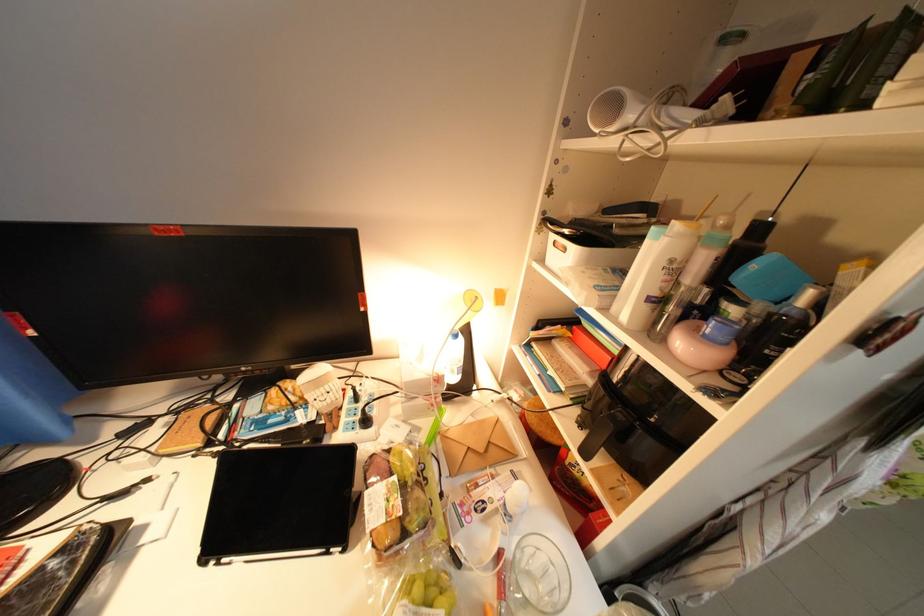
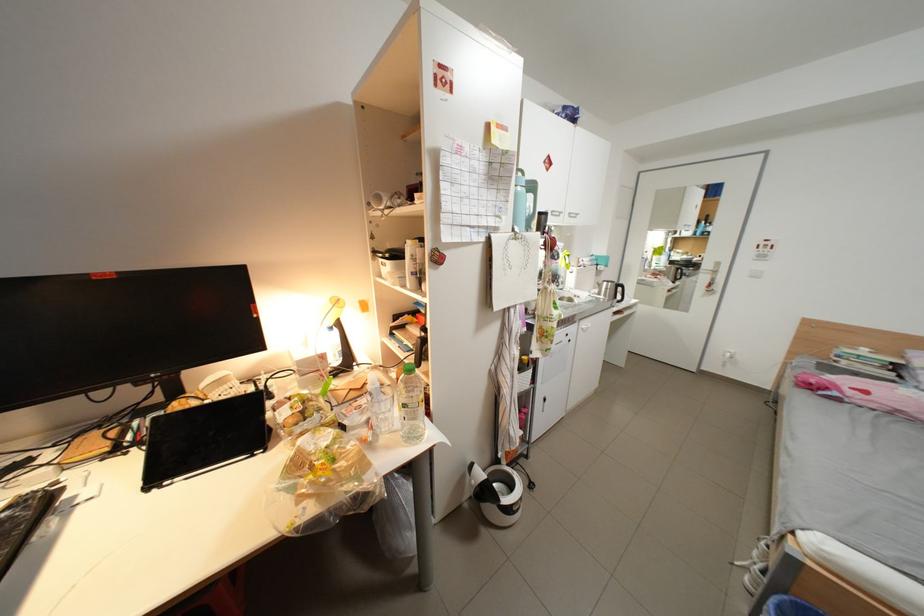
The point at (450, 381) is marked in the first image. Where is the corresponding point in the second image?

(334, 358)